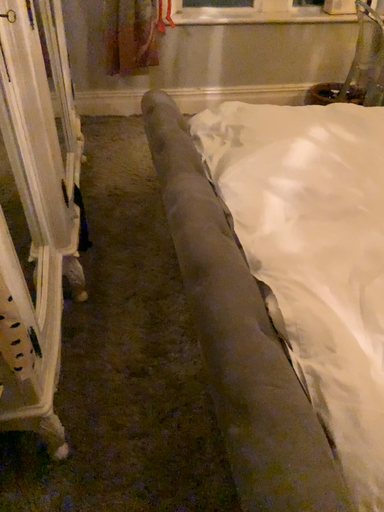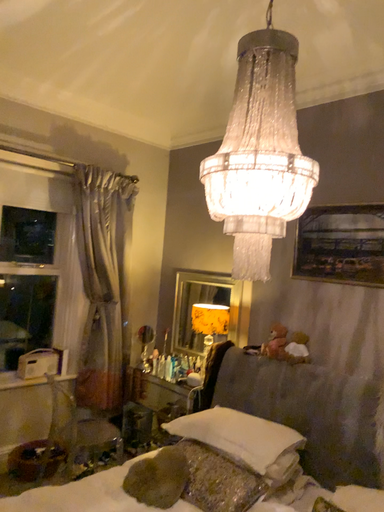
Question: How did the camera likely rotate when shooting the video?

Choices:
 (A) rotated downward
 (B) rotated upward

Answer: (B)